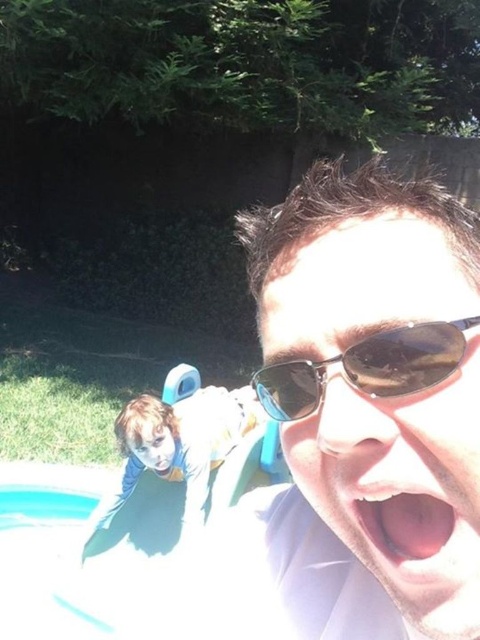
Question: Is sunglasses at center bigger than pink flesh at center?

Choices:
 (A) yes
 (B) no

Answer: (A)

Question: Does sunglasses at center appear under pink flesh at center?

Choices:
 (A) yes
 (B) no

Answer: (B)

Question: Which object is the farthest from the sunglasses at center?

Choices:
 (A) black reflective sunglasses at upper center
 (B) pink flesh at center

Answer: (A)

Question: Does sunglasses at center come in front of black reflective sunglasses at upper center?

Choices:
 (A) no
 (B) yes

Answer: (A)

Question: Which of the following is the farthest from the observer?

Choices:
 (A) pink flesh at center
 (B) sunglasses at center

Answer: (A)

Question: Which point appears closest to the camera in this image?

Choices:
 (A) (433, 545)
 (B) (400, 365)

Answer: (B)